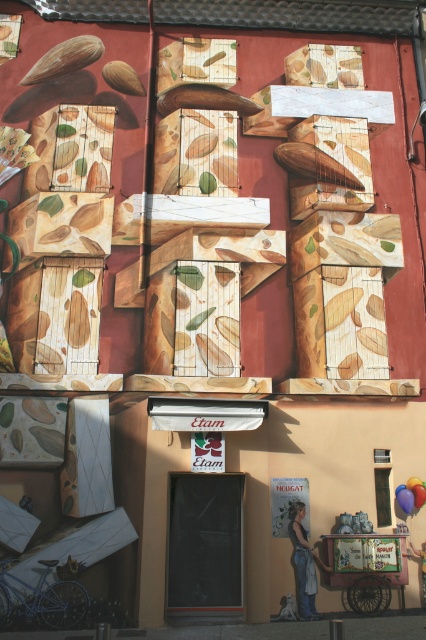
Question: Is the position of matte brown mushroom at upper left more distant than that of brown wood nut at upper left?

Choices:
 (A) no
 (B) yes

Answer: (A)

Question: Among these objects, which one is nearest to the camera?

Choices:
 (A) matte brown mushroom at upper left
 (B) brown wood nut at upper left

Answer: (A)

Question: Is matte brown mushroom at upper left to the right of brown wood nut at upper left from the viewer's perspective?

Choices:
 (A) yes
 (B) no

Answer: (B)

Question: Can you confirm if matte brown mushroom at upper left is positioned to the left of brown wood nut at upper left?

Choices:
 (A) yes
 (B) no

Answer: (A)

Question: Which object appears closest to the camera in this image?

Choices:
 (A) matte brown mushroom at upper left
 (B) brown wood nut at upper left

Answer: (A)